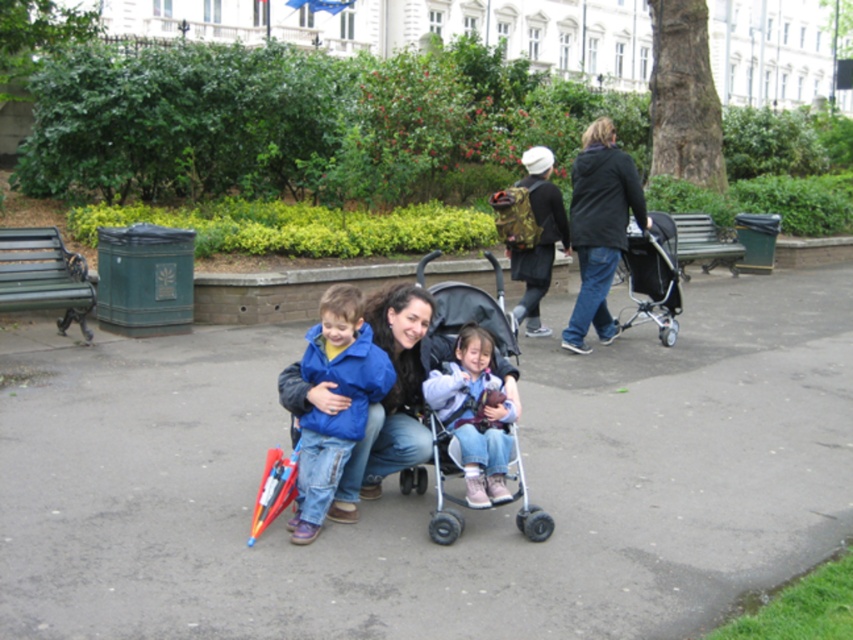
Who is positioned more to the right, blue matte jacket at center or black textured stroller at center right?

black textured stroller at center right

Does blue matte jacket at center have a lesser width compared to black textured stroller at center right?

Yes.

The height and width of the screenshot is (640, 853). I want to click on blue matte jacket at center, so click(339, 394).

Who is positioned more to the right, gray asphalt pavement at center or blue matte jacket at center?

Result: gray asphalt pavement at center is more to the right.

Who is shorter, gray asphalt pavement at center or blue matte jacket at center?

Standing shorter between the two is blue matte jacket at center.

What do you see at coordinates (432, 483) in the screenshot?
I see `gray asphalt pavement at center` at bounding box center [432, 483].

Find the location of a particular element. This screenshot has height=640, width=853. gray asphalt pavement at center is located at coordinates (432, 483).

Is point (28, 490) in front of point (537, 200)?

Yes, point (28, 490) is closer to viewer.

From the picture: Which is above, gray asphalt pavement at center or camouflage backpack at upper center?

camouflage backpack at upper center

Locate an element on the screen. The height and width of the screenshot is (640, 853). gray asphalt pavement at center is located at coordinates (432, 483).

You are a GUI agent. You are given a task and a screenshot of the screen. Output one action in this format:
    pyautogui.click(x=<x>, y=<y>)
    Task: Click on the gray asphalt pavement at center
    
    Given the screenshot: What is the action you would take?
    pyautogui.click(x=432, y=483)